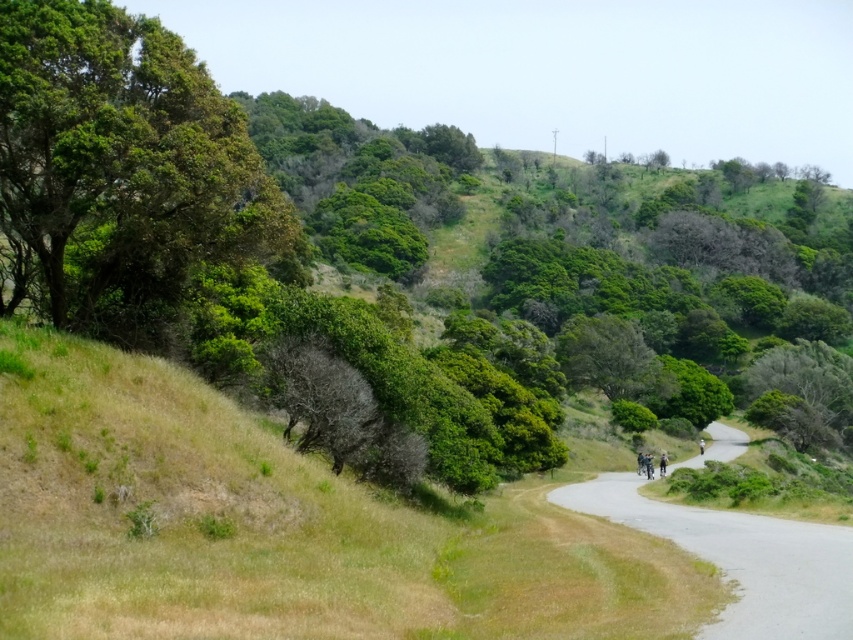
You are a hiker standing on the gray asphalt road at center and want to take a photo of the green leafy tree at left. Which direction should you face to capture the tree in your shot?

You should face towards the left side since the green leafy tree at left is positioned to the left of the gray asphalt road at center, so facing that direction will allow you to capture it in your photo.

You are a hiker who wants to take a photo of the green leafy tree at left and the gray asphalt road at center in the same frame. Based on the distance between them, will you need to zoom out or zoom in your camera lens to capture both objects in the frame?

The green leafy tree at left and gray asphalt road at center are 16.95 meters apart from each other. To capture both in the same frame, you would need to zoom out to widen the field of view.